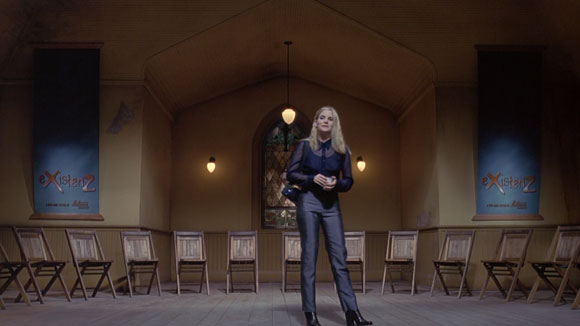
Where is `chairs`? chairs is located at coordinates (188, 262).